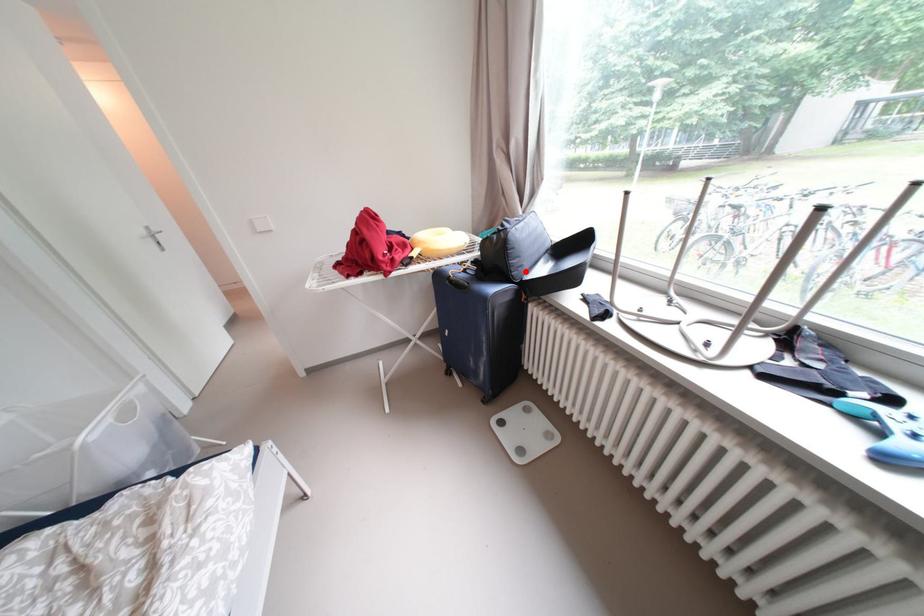
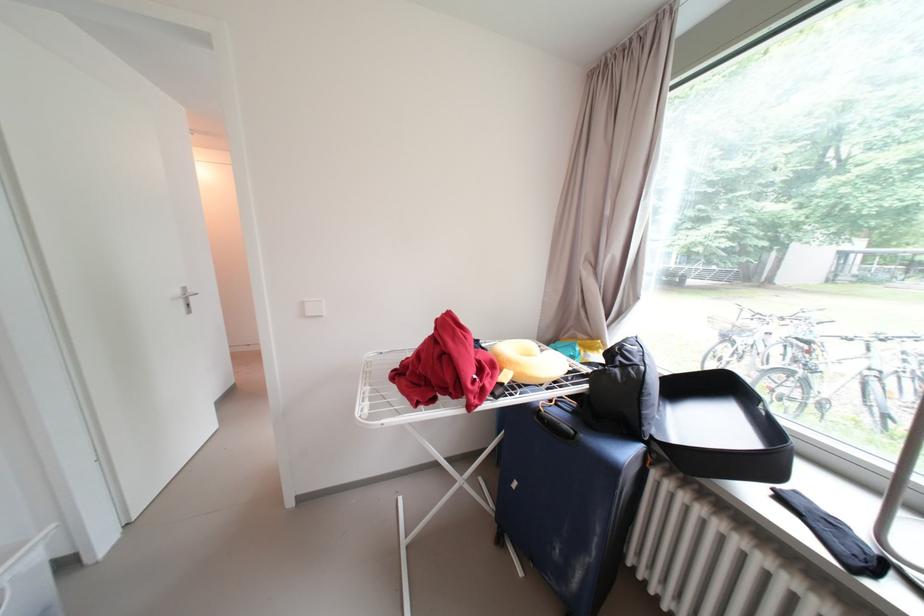
In the second image, find the point that corresponds to the highlighted location in the first image.

(658, 424)